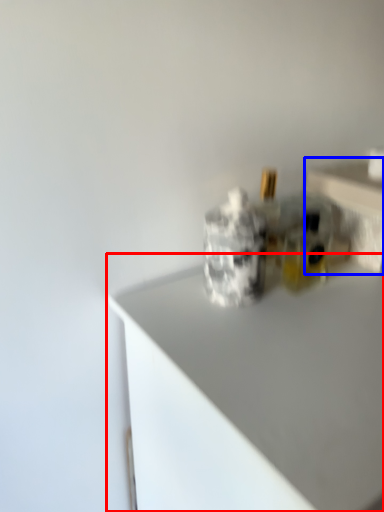
Question: Which of the following is the farthest to the observer, countertop (highlighted by a red box) or table (highlighted by a blue box)?

Choices:
 (A) countertop
 (B) table

Answer: (B)